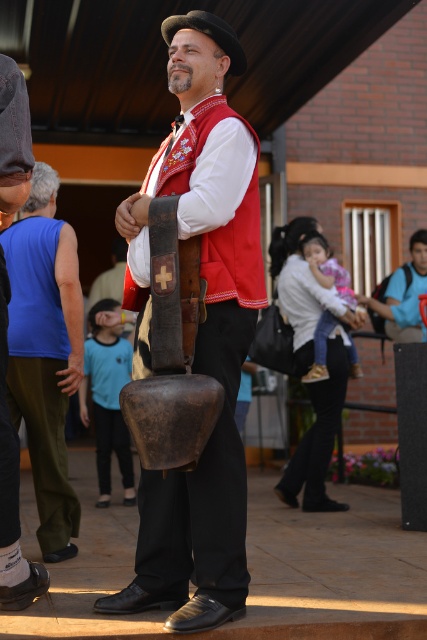
Question: Among these points, which one is farthest from the camera?

Choices:
 (A) (205, 168)
 (B) (46, 355)

Answer: (B)

Question: Can you confirm if wooden bell at center is smaller than blue sleeveless shirt at left?

Choices:
 (A) no
 (B) yes

Answer: (A)

Question: Which of the following is the closest to the observer?

Choices:
 (A) wooden bell at center
 (B) blue sleeveless shirt at left

Answer: (A)

Question: Can you confirm if wooden bell at center is thinner than blue sleeveless shirt at left?

Choices:
 (A) no
 (B) yes

Answer: (A)

Question: Can you confirm if wooden bell at center is positioned to the left of blue sleeveless shirt at left?

Choices:
 (A) yes
 (B) no

Answer: (B)